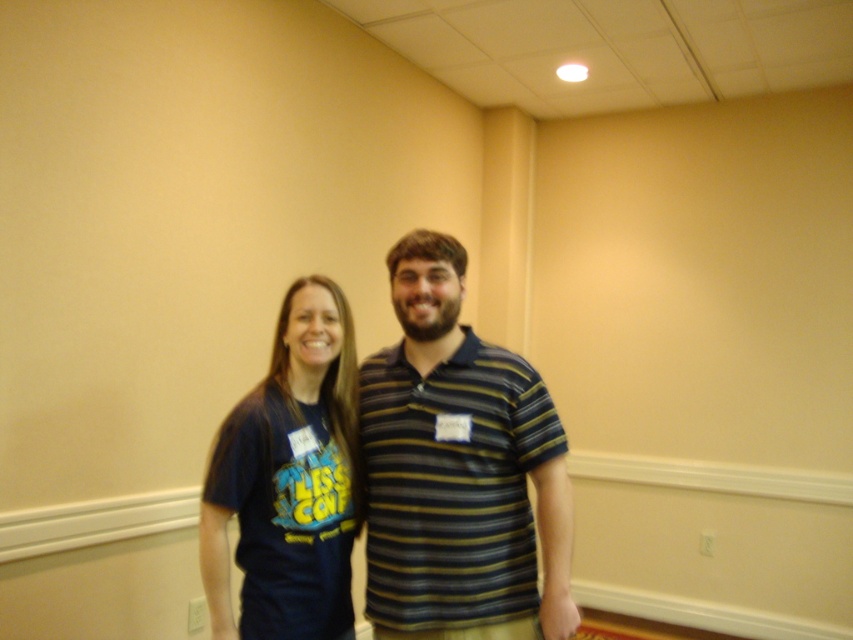
Based on the coordinates provided, which object is located at point (457,468)?

The point (457,468) marks the striped polo shirt at center.